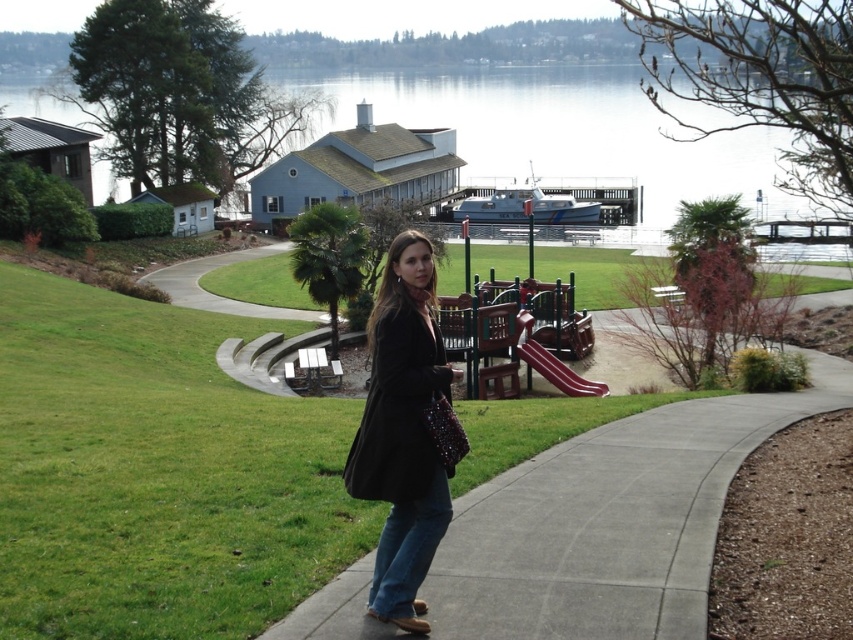
Is gray concrete sidewalk at center bigger than clear water at center?

No, gray concrete sidewalk at center is not bigger than clear water at center.

Is gray concrete sidewalk at center positioned in front of clear water at center?

Yes, it is.

Is point (363, 605) in front of point (509, 176)?

Yes, point (363, 605) is closer to viewer.

I want to click on gray concrete sidewalk at center, so click(x=606, y=524).

Which is more to the right, clear water at center or green grass at center?

green grass at center

Between clear water at center and green grass at center, which one is positioned higher?

clear water at center is higher up.

Does point (515, 168) come closer to viewer compared to point (192, 264)?

That is False.

Where is `clear water at center`? clear water at center is located at coordinates (561, 131).

Is black matte coat at center taller than blue denim jeans at lower center?

In fact, black matte coat at center may be shorter than blue denim jeans at lower center.

Can you confirm if black matte coat at center is thinner than blue denim jeans at lower center?

Yes, black matte coat at center is thinner than blue denim jeans at lower center.

What do you see at coordinates (403, 432) in the screenshot?
I see `black matte coat at center` at bounding box center [403, 432].

Find the location of a particular element. The image size is (853, 640). black matte coat at center is located at coordinates (403, 432).